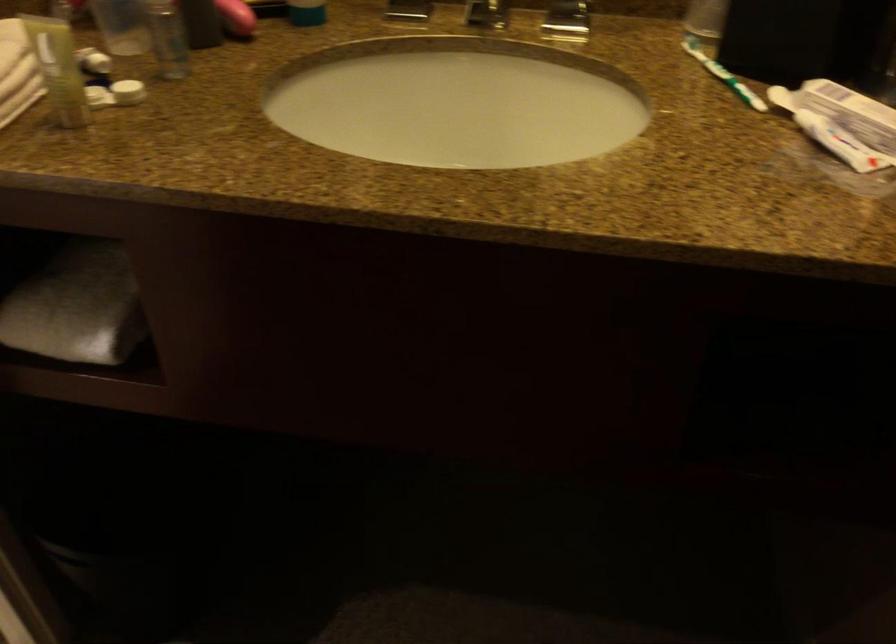
I want to click on green cosmetic tube, so click(306, 13).